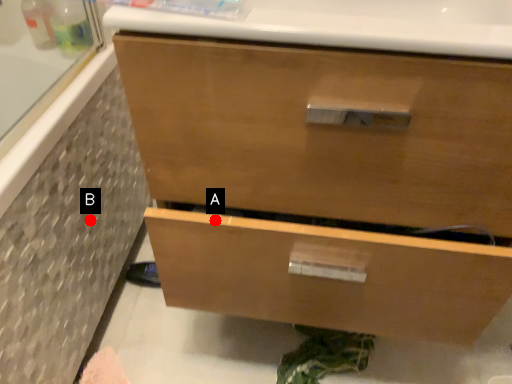
Question: Two points are circled on the image, labeled by A and B beside each circle. Which point is closer to the camera?

Choices:
 (A) A is closer
 (B) B is closer

Answer: (A)